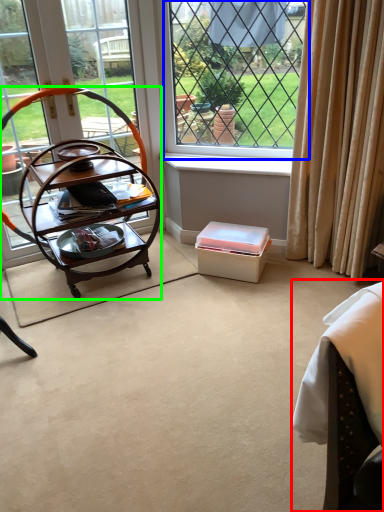
Question: Which object is positioned closest to swivel chair (highlighted by a red box)? Select from window (highlighted by a blue box) and desk (highlighted by a green box).

Choices:
 (A) window
 (B) desk

Answer: (B)